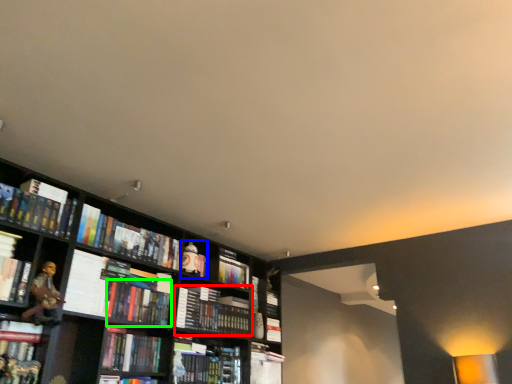
Question: Which object is positioned farthest from book (highlighted by a red box)? Select from book (highlighted by a blue box) and book (highlighted by a green box).

Choices:
 (A) book
 (B) book

Answer: (B)